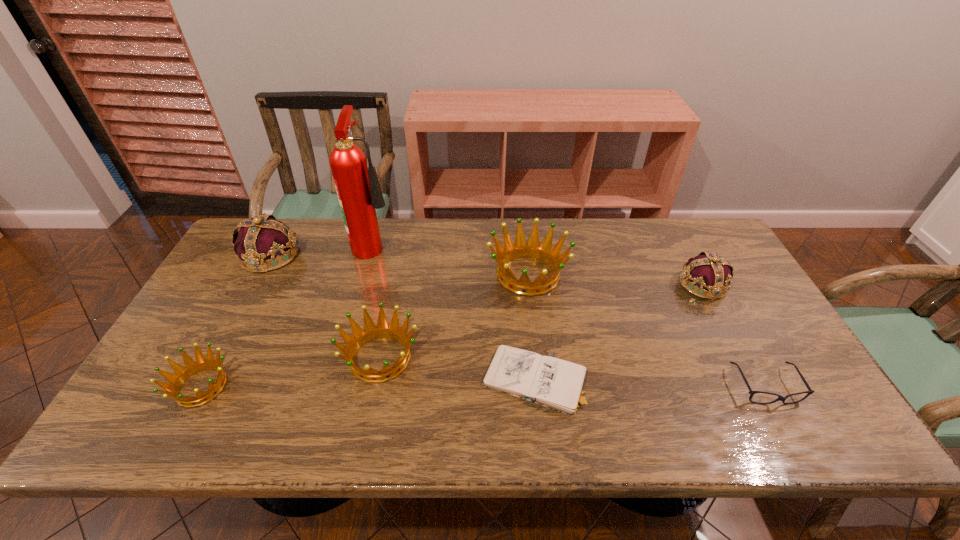
Locate an element on the screen. This screenshot has height=540, width=960. fire extinguisher is located at coordinates (359, 193).

Find the location of a particular element. The height and width of the screenshot is (540, 960). red fire extinguisher is located at coordinates (359, 193).

I want to click on the bigger purple crown, so click(x=261, y=244).

This screenshot has width=960, height=540. I want to click on the seventh shortest object, so click(x=261, y=244).

Find the location of a particular element. the fourth crown from left to right is located at coordinates (520, 248).

I want to click on the biggest golden crown, so click(520, 248).

The image size is (960, 540). Find the location of `the rightmost crown`. the rightmost crown is located at coordinates (707, 271).

I want to click on the right purple crown, so click(707, 271).

You are a GUI agent. You are given a task and a screenshot of the screen. Output one action in this format:
    pyautogui.click(x=<x>, y=<y>)
    Task: Click on the third crown from right to left
    
    Given the screenshot: What is the action you would take?
    pyautogui.click(x=371, y=332)

What are the coordinates of `the second smallest golden crown` in the screenshot? It's located at (371, 332).